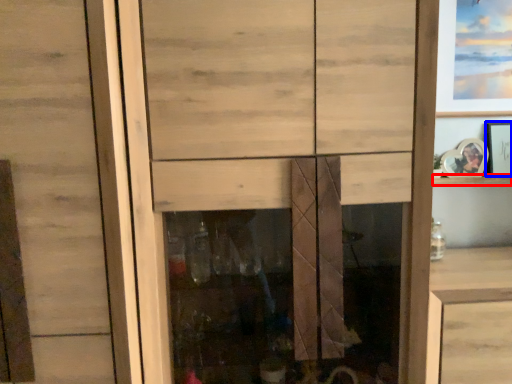
Question: Among these objects, which one is farthest to the camera, shelf (highlighted by a red box) or picture frame (highlighted by a blue box)?

Choices:
 (A) shelf
 (B) picture frame

Answer: (A)